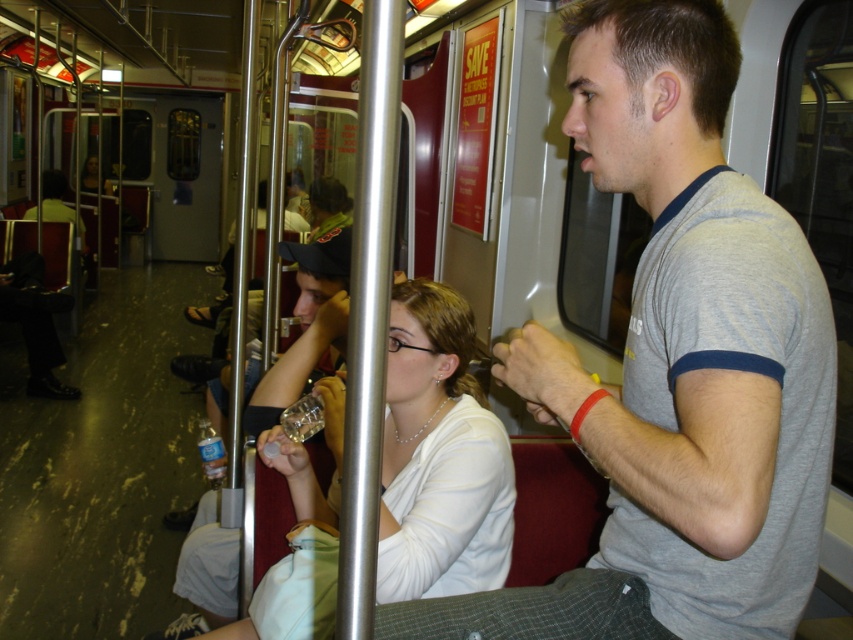
You are a delivery robot with a 2.5 feet wide package. You need to move from the back of the subway car to the front. There is a white matte shirt at center and a translucent plastic bottle at lower left blocking your path. Can you navigate around them without moving the objects?

The distance between the white matte shirt at center and the translucent plastic bottle at lower left is 4.52 feet. Since your package is 2.5 feet wide, there is enough space to navigate around them without moving the objects.

Consider the image. You are a passenger in the subway car and want to place your bag on the seat between the white matte shirt at center and the translucent plastic bottle at lower left. Is there enough space for your bag?

The white matte shirt at center is in front of the translucent plastic bottle at lower left, so placing your bag between them might not be possible as the shirt is blocking the space between the two objects.